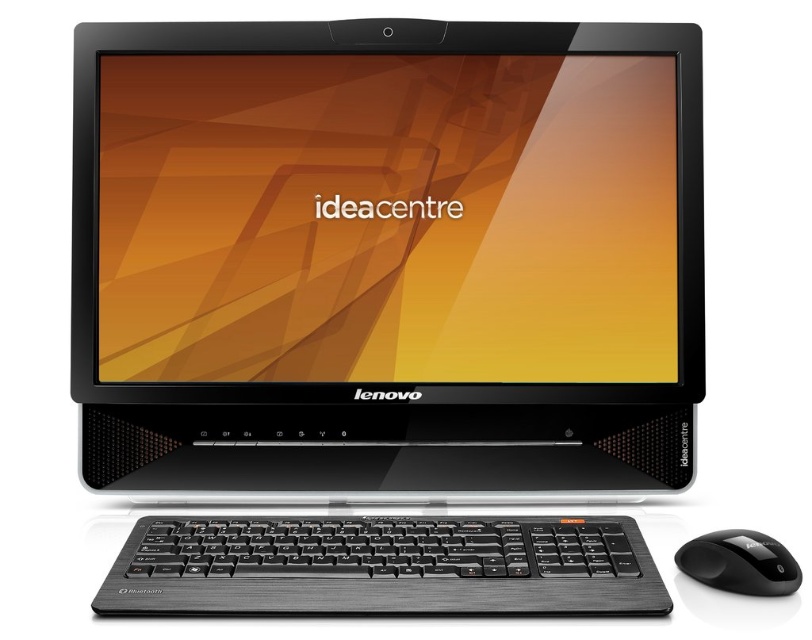
Question: In this image, where is black matte laptop at center located relative to black plastic mouse at lower right?

Choices:
 (A) below
 (B) above

Answer: (B)

Question: Can you confirm if black matte laptop at center is positioned to the right of black plastic mouse at lower right?

Choices:
 (A) yes
 (B) no

Answer: (B)

Question: Which object is positioned closest to the black plastic mouse at lower right?

Choices:
 (A) black brushed metal keyboard at lower center
 (B) black matte laptop at center

Answer: (A)

Question: Is black matte laptop at center closer to the viewer compared to black brushed metal keyboard at lower center?

Choices:
 (A) yes
 (B) no

Answer: (B)

Question: Among these objects, which one is farthest from the camera?

Choices:
 (A) black matte laptop at center
 (B) black brushed metal keyboard at lower center
 (C) black plastic mouse at lower right

Answer: (A)

Question: Which of the following is the farthest from the observer?

Choices:
 (A) (443, 538)
 (B) (411, 100)

Answer: (B)